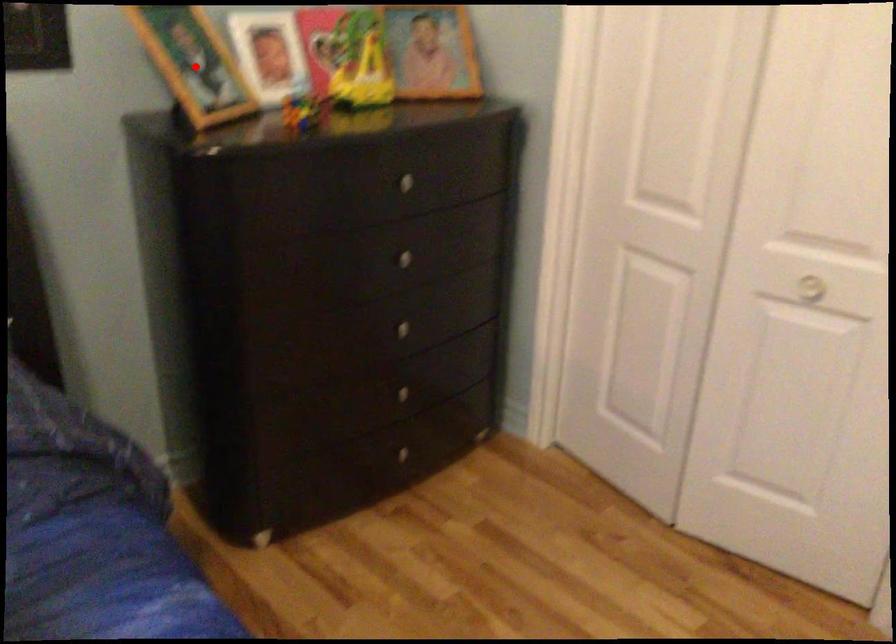
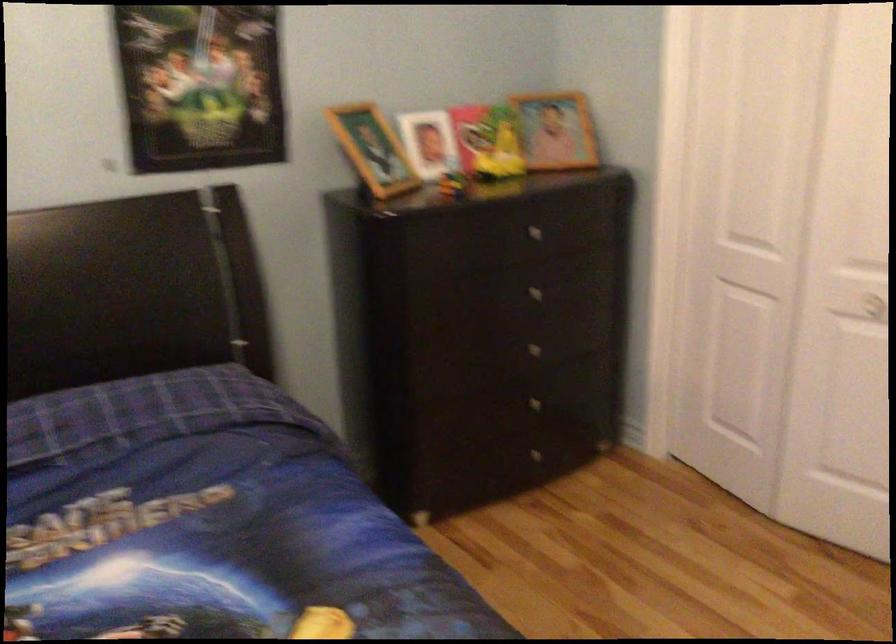
Where in the second image is the point corresponding to the highlighted location from the first image?

(373, 149)